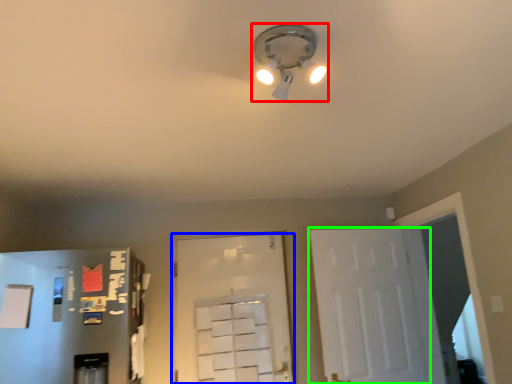
Question: Which object is positioned farthest from lamp (highlighted by a red box)? Select from door (highlighted by a blue box) and door (highlighted by a green box).

Choices:
 (A) door
 (B) door

Answer: (A)